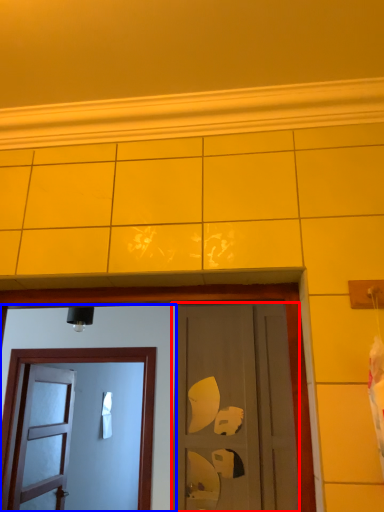
Question: Which of the following is the closest to the observer, door (highlighted by a red box) or door (highlighted by a blue box)?

Choices:
 (A) door
 (B) door

Answer: (A)